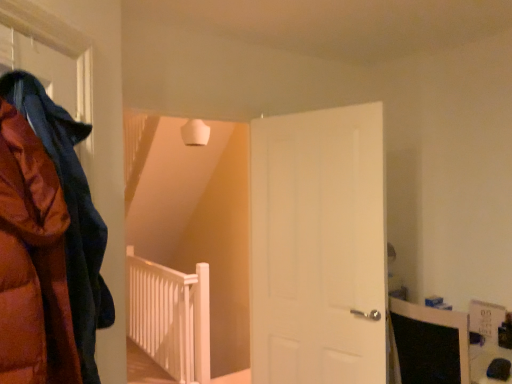
Question: Does white matte door at center have a lesser width compared to white wooden rail at center?

Choices:
 (A) yes
 (B) no

Answer: (A)

Question: Considering the relative sizes of white matte door at center and white wooden rail at center in the image provided, is white matte door at center wider than white wooden rail at center?

Choices:
 (A) yes
 (B) no

Answer: (B)

Question: Would you consider white matte door at center to be distant from white wooden rail at center?

Choices:
 (A) no
 (B) yes

Answer: (B)

Question: Considering the relative sizes of white matte door at center and white wooden rail at center in the image provided, is white matte door at center smaller than white wooden rail at center?

Choices:
 (A) yes
 (B) no

Answer: (A)

Question: Does white matte door at center turn towards white wooden rail at center?

Choices:
 (A) yes
 (B) no

Answer: (B)

Question: From a real-world perspective, relative to white wooden rail at center, is matte orange puffer jacket at left vertically above or below?

Choices:
 (A) below
 (B) above

Answer: (B)

Question: In terms of width, does matte orange puffer jacket at left look wider or thinner when compared to white wooden rail at center?

Choices:
 (A) wide
 (B) thin

Answer: (A)

Question: Considering the positions of matte orange puffer jacket at left and white wooden rail at center in the image, is matte orange puffer jacket at left taller or shorter than white wooden rail at center?

Choices:
 (A) short
 (B) tall

Answer: (A)

Question: Looking at the image, does matte orange puffer jacket at left seem bigger or smaller compared to white wooden rail at center?

Choices:
 (A) big
 (B) small

Answer: (B)

Question: Relative to matte orange puffer jacket at left, is white matte door at center in front or behind?

Choices:
 (A) front
 (B) behind

Answer: (B)

Question: From a real-world perspective, relative to matte orange puffer jacket at left, is white matte door at center vertically above or below?

Choices:
 (A) below
 (B) above

Answer: (A)

Question: Considering the positions of white matte door at center and matte orange puffer jacket at left in the image, is white matte door at center taller or shorter than matte orange puffer jacket at left?

Choices:
 (A) short
 (B) tall

Answer: (B)

Question: Which is correct: white matte door at center is inside matte orange puffer jacket at left, or outside of it?

Choices:
 (A) outside
 (B) inside

Answer: (A)

Question: Is white matte door at center wider or thinner than white wooden rail at center?

Choices:
 (A) thin
 (B) wide

Answer: (A)

Question: From a real-world perspective, is white matte door at center positioned above or below white wooden rail at center?

Choices:
 (A) above
 (B) below

Answer: (A)